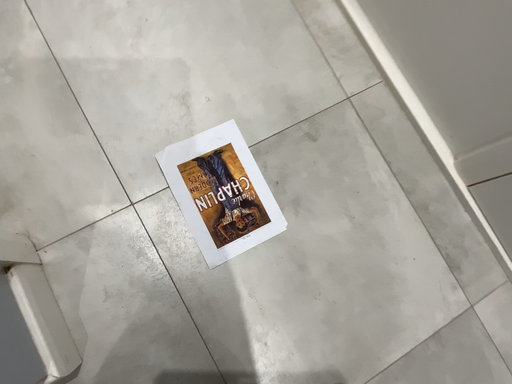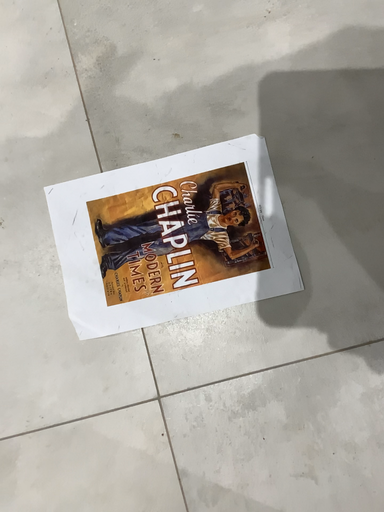
Question: How did the camera likely rotate when shooting the video?

Choices:
 (A) rotated downward
 (B) rotated upward

Answer: (A)